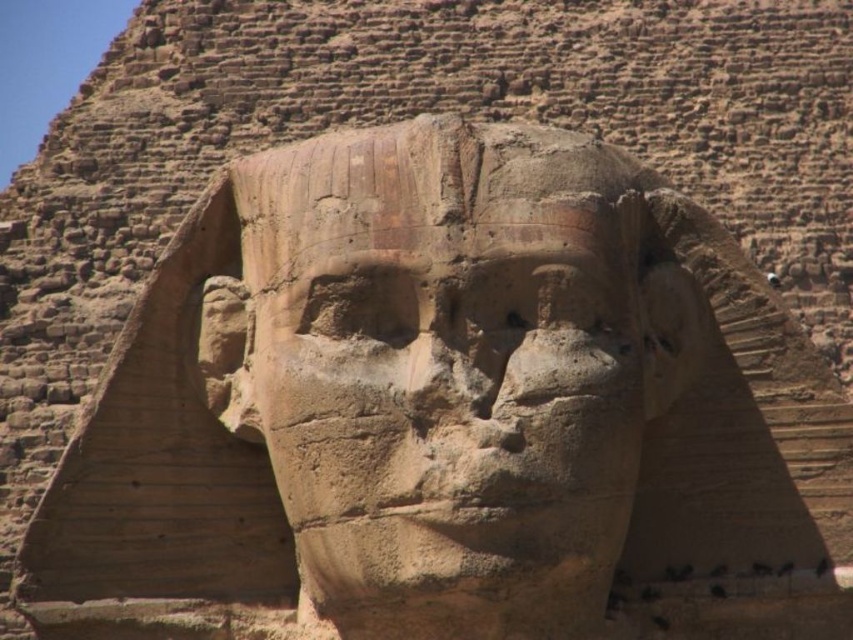
Consider the image. Does sandstone statue at center have a greater height compared to brown stone nose at center?

Yes, sandstone statue at center is taller than brown stone nose at center.

Who is positioned more to the right, sandstone statue at center or brown stone nose at center?

From the viewer's perspective, sandstone statue at center appears more on the right side.

In order to click on sandstone statue at center in this screenshot , I will do `click(440, 336)`.

Find the location of a particular element. The height and width of the screenshot is (640, 853). sandstone statue at center is located at coordinates click(x=440, y=336).